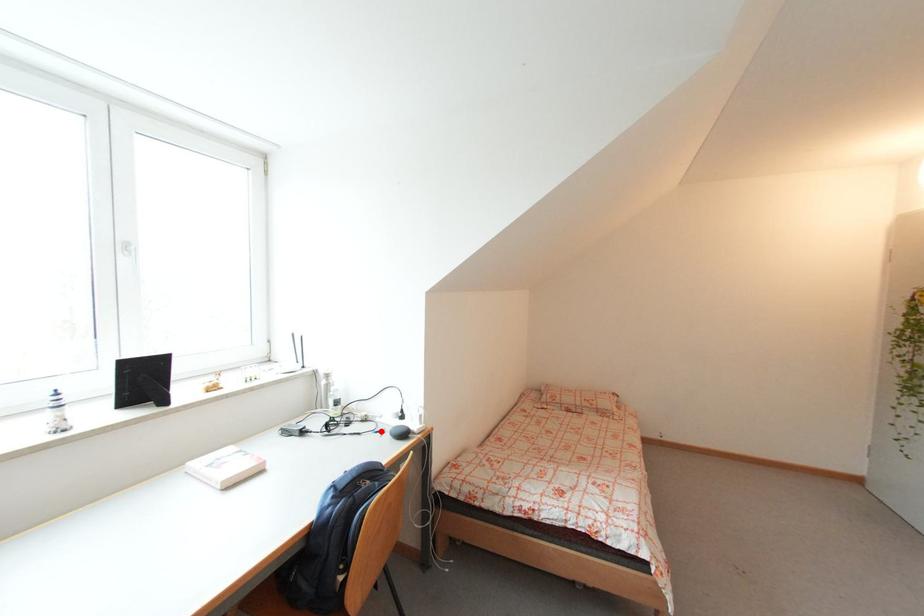
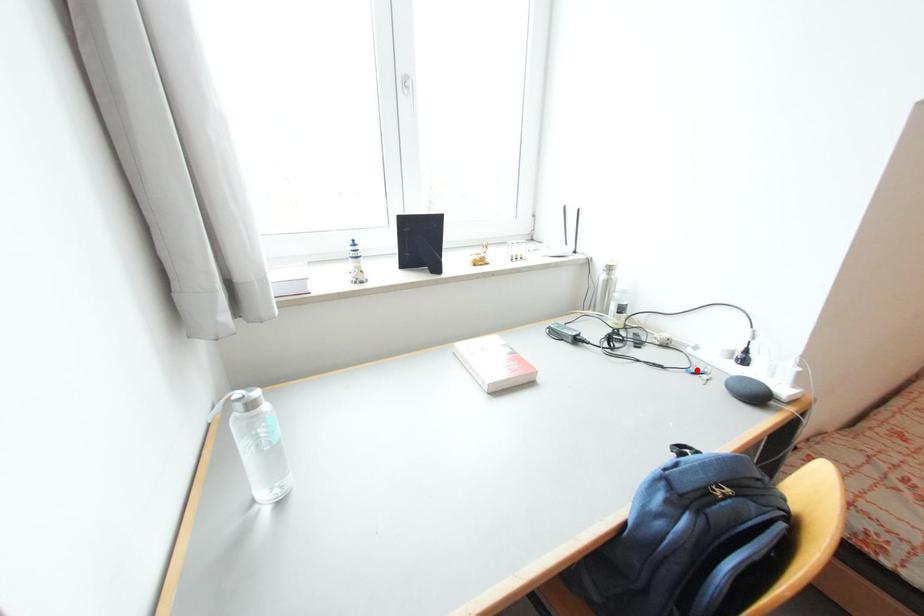
I am providing you with two images of the same scene from different viewpoints. A red point is marked on the first image and another point is marked on the second image. Is the red point in image1 aligned with the point shown in image2?

Yes